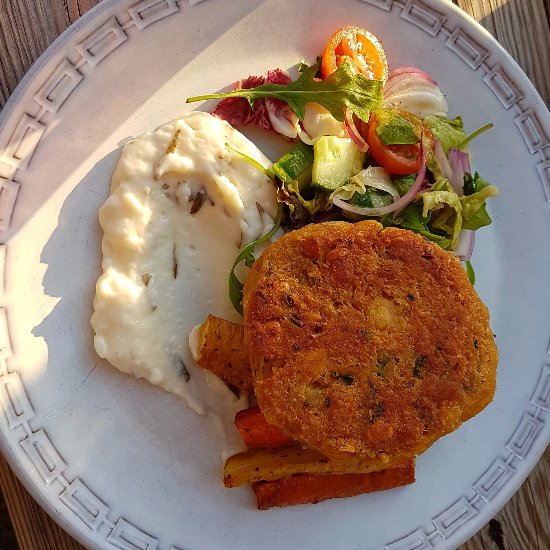
Locate an element on the screen. The image size is (550, 550). decorative pattern on edge of plate is located at coordinates (51, 94), (85, 512), (498, 474), (497, 75).